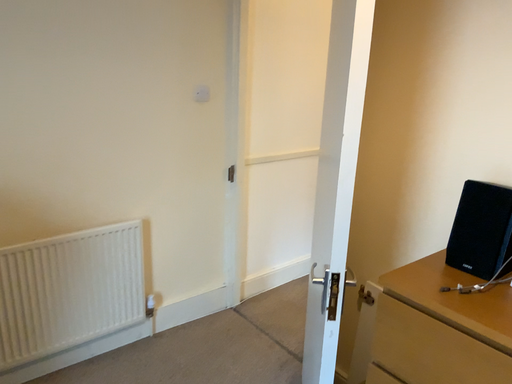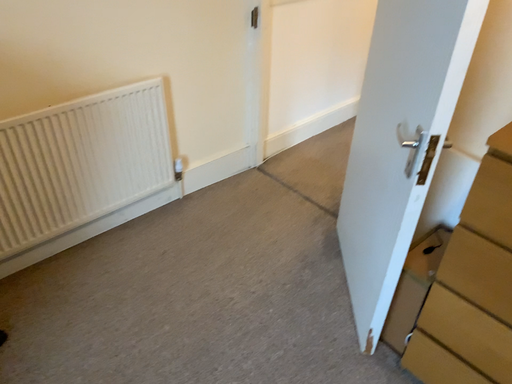
Question: How did the camera likely rotate when shooting the video?

Choices:
 (A) rotated downward
 (B) rotated upward

Answer: (A)